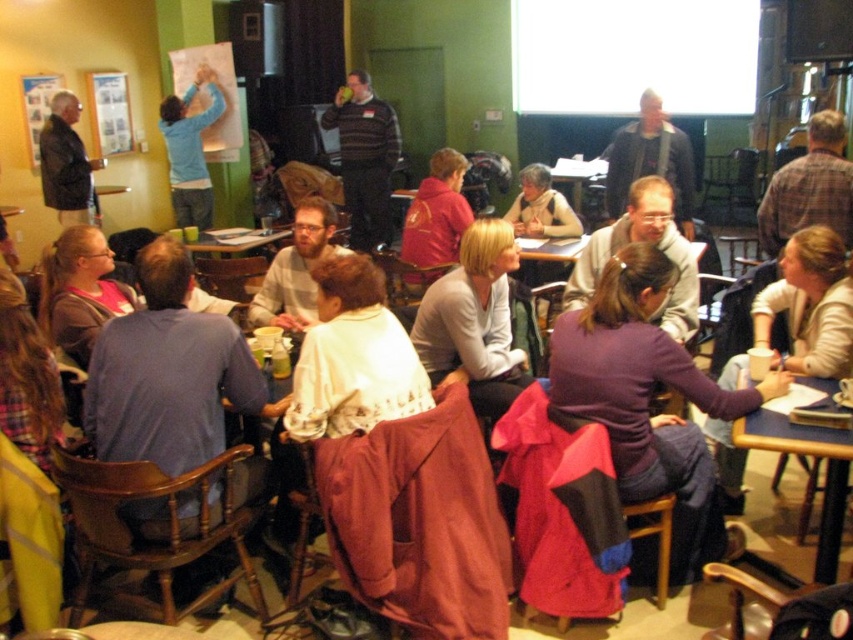
You are organizing a photo shoot and need to ensure that all clothing items in the scene are visible. Given that the plaid shirt at center and the matte red hoodie at center are both in the foreground, which clothing item might you need to adjust the lighting on to ensure it doesn t get lost in the composition?

The matte red hoodie at center might need adjusted lighting since it is smaller than the plaid shirt at center and could be less visible in the composition.

You are standing at the back of the room and want to take a photo of both point (840, 136) and point (402, 248). Which point will appear larger in your photo?

Point (840, 136) is closer to the camera than point (402, 248), so it will appear larger in the photo.